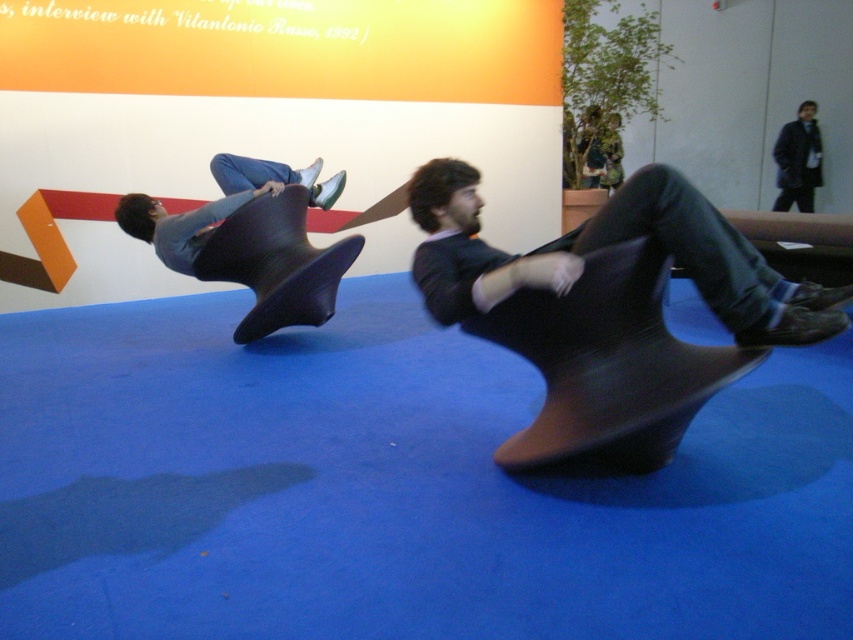
You are a maintenance worker needing to move a 1.5 meter long equipment between the two matte black chairs. Can the equipment fit between the matte black chair at center and the matte black chair at left?

The distance between the matte black chair at center and the matte black chair at left is 1.65 meters. Since the equipment is 1.5 meters long, it can fit between them as the space is wider than the equipment.